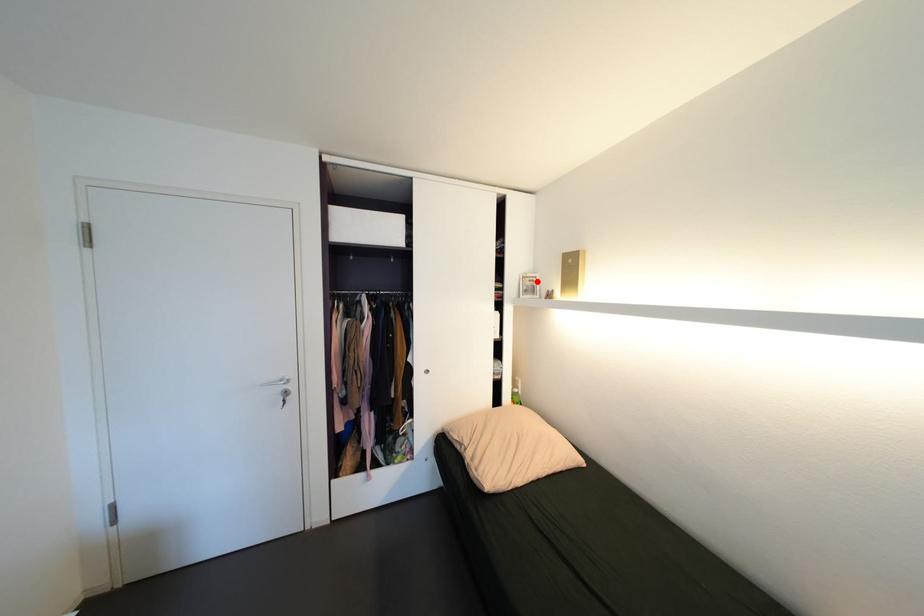
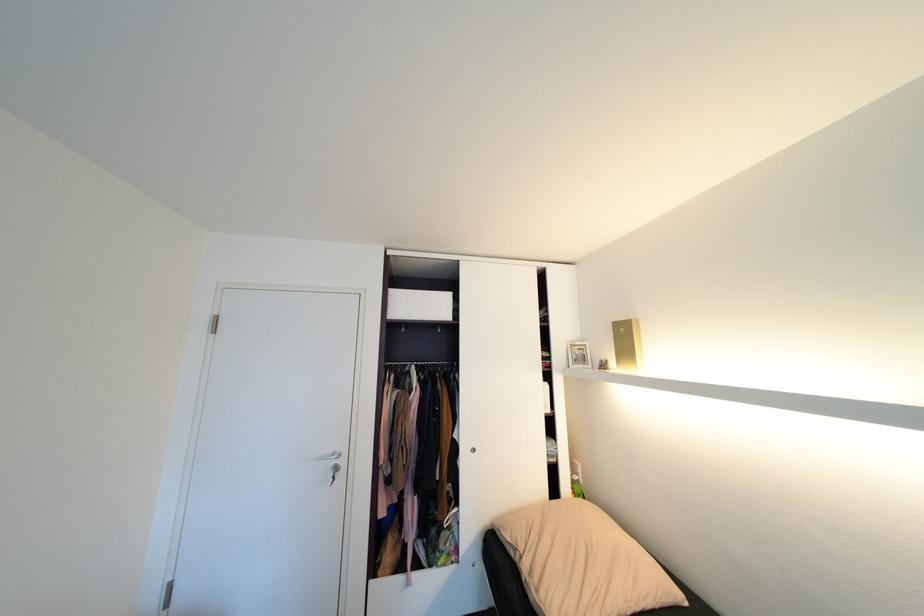
The point at the highlighted location is marked in the first image. Where is the corresponding point in the second image?

(587, 350)